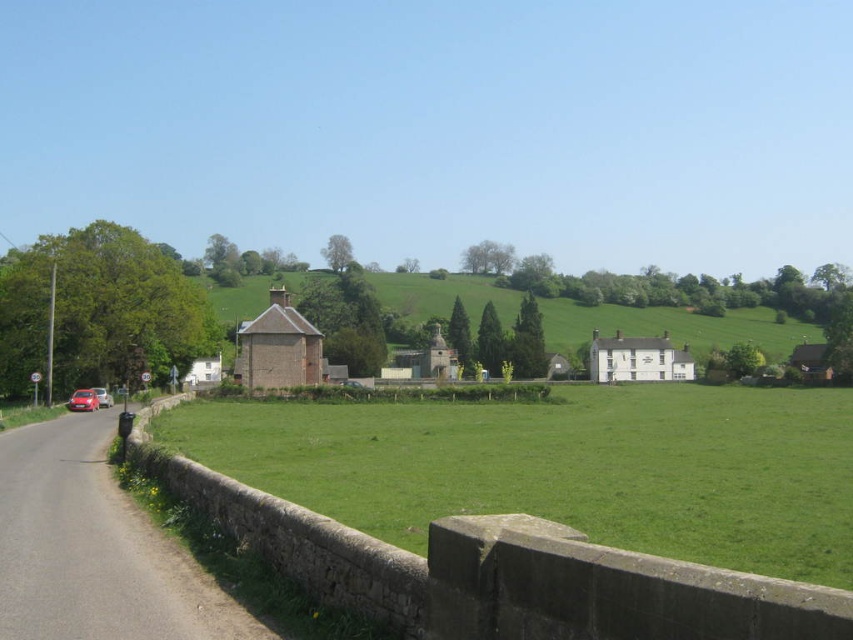
Between green grassy hillside at center and metallic red car at left, which one is positioned higher?

green grassy hillside at center is higher up.

From the picture: Does green grassy hillside at center appear under metallic red car at left?

No, green grassy hillside at center is not below metallic red car at left.

Find the location of `green grassy hillside at center`. green grassy hillside at center is located at coordinates (675, 324).

Is point (86, 392) closer to viewer compared to point (100, 401)?

That is True.

Is metallic red car at left thinner than matte silver car at left?

Incorrect, metallic red car at left's width is not less than matte silver car at left's.

Measure the distance between metallic red car at left and camera.

60.41 meters

The width and height of the screenshot is (853, 640). I want to click on metallic red car at left, so click(83, 401).

Can you confirm if green grass field at center is shorter than matte silver car at left?

No.

Is green grass field at center thinner than matte silver car at left?

No.

At what (x,y) coordinates should I click in order to perform the action: click on green grass field at center. Please return your answer as a coordinate pair (x, y). Looking at the image, I should click on (563, 467).

You are a GUI agent. You are given a task and a screenshot of the screen. Output one action in this format:
    pyautogui.click(x=<x>, y=<y>)
    Task: Click on the green grass field at center
    
    Given the screenshot: What is the action you would take?
    pyautogui.click(x=563, y=467)